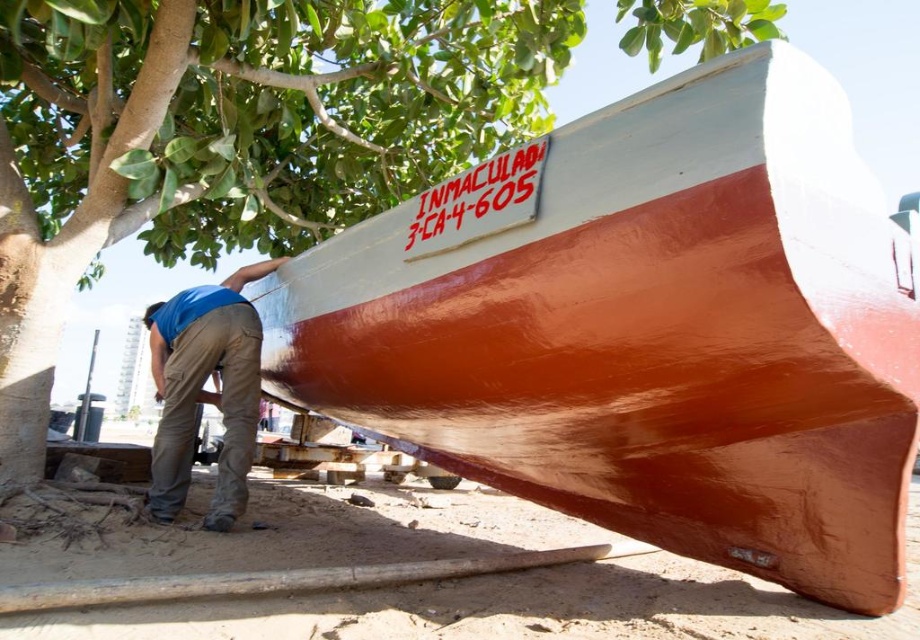
Does shiny orange hull at center have a lesser height compared to blue cotton shirt at lower left?

No, shiny orange hull at center is not shorter than blue cotton shirt at lower left.

Is shiny orange hull at center wider than blue cotton shirt at lower left?

Indeed, shiny orange hull at center has a greater width compared to blue cotton shirt at lower left.

Locate an element on the screen. The width and height of the screenshot is (920, 640). shiny orange hull at center is located at coordinates (645, 328).

Does green leafy tree at upper left have a larger size compared to smooth brown sand at lower center?

Yes, green leafy tree at upper left is bigger than smooth brown sand at lower center.

Is green leafy tree at upper left below smooth brown sand at lower center?

No.

In order to click on green leafy tree at upper left in this screenshot , I will do [233, 134].

The width and height of the screenshot is (920, 640). I want to click on green leafy tree at upper left, so click(233, 134).

Who is positioned more to the left, shiny orange hull at center or green leafy tree at upper left?

green leafy tree at upper left is more to the left.

Does shiny orange hull at center appear on the left side of green leafy tree at upper left?

In fact, shiny orange hull at center is to the right of green leafy tree at upper left.

Is point (891, 499) more distant than point (368, 129)?

No, it is in front of (368, 129).

The image size is (920, 640). Identify the location of shiny orange hull at center. [645, 328].